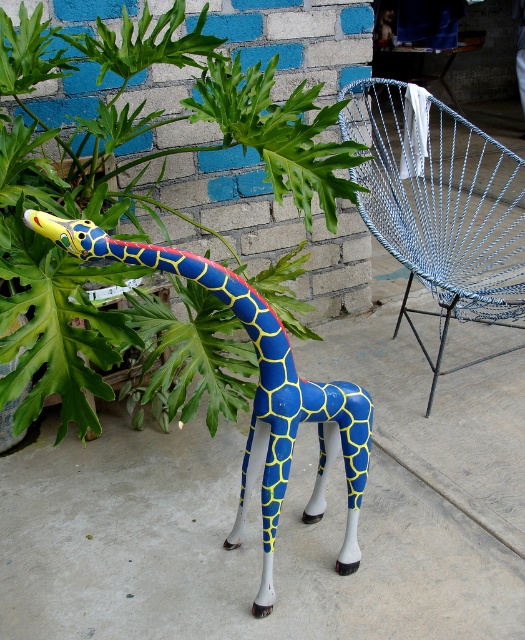
Describe the element at coordinates (441, 205) in the screenshot. I see `blue woven wire chair at right` at that location.

Which of these two, blue woven wire chair at right or blue glossy giraffe at center, stands shorter?

With less height is blue glossy giraffe at center.

Is point (476, 168) behind point (264, 508)?

Yes.

Where is `blue woven wire chair at right`? The height and width of the screenshot is (640, 525). blue woven wire chair at right is located at coordinates (441, 205).

Who is lower down, green leafy plant at center or blue glossy giraffe at center?

Positioned lower is blue glossy giraffe at center.

Is point (253, 179) behind point (245, 506)?

That is True.

Measure the distance between green leafy plant at center and camera.

They are 3.72 feet apart.

Image resolution: width=525 pixels, height=640 pixels. I want to click on green leafy plant at center, so click(x=135, y=173).

Does point (14, 106) come behind point (484, 157)?

No, (14, 106) is in front of (484, 157).

Is green leafy plant at center above blue woven wire chair at right?

No.

Measure the distance between point (x=4, y=164) and camera.

4.75 feet

Identify the location of green leafy plant at center. (135, 173).